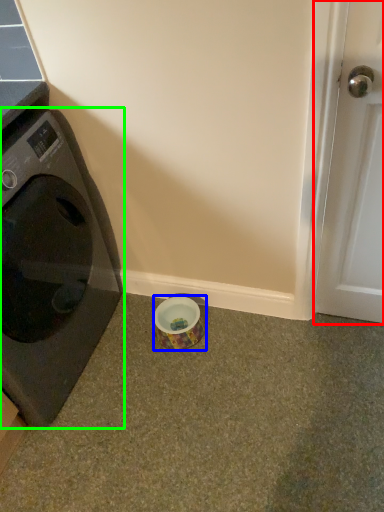
Question: Estimate the real-world distances between objects in this image. Which object is closer to door (highlighted by a red box), tape (highlighted by a blue box) or washing machine (highlighted by a green box)?

Choices:
 (A) tape
 (B) washing machine

Answer: (A)